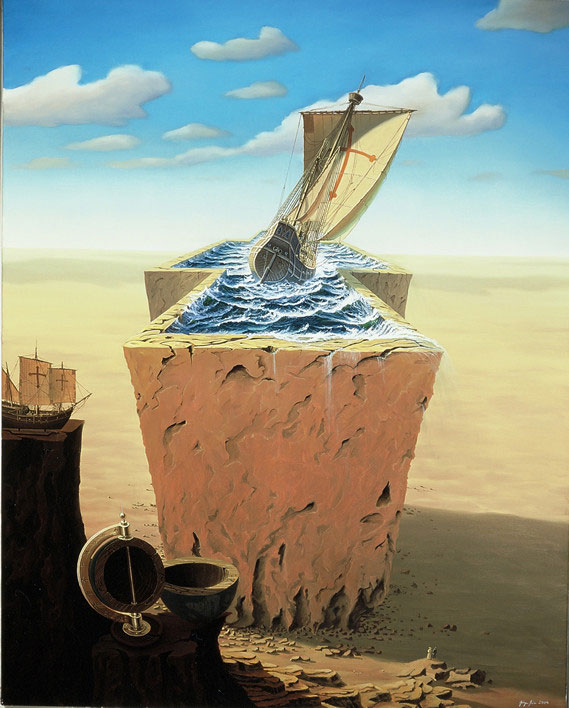
You are a GUI agent. You are given a task and a screenshot of the screen. Output one action in this format:
    pyautogui.click(x=<x>, y=<y>)
    Task: Click on the globe
    
    Given the screenshot: What is the action you would take?
    pyautogui.click(x=117, y=598)